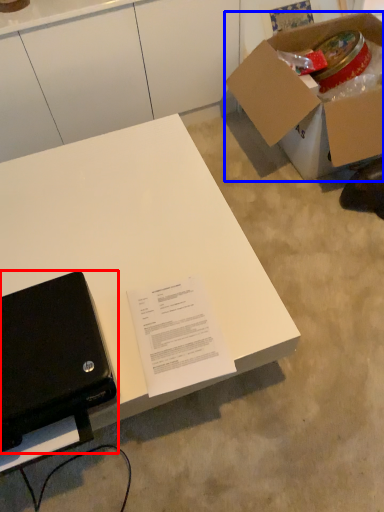
Question: Which point is closer to the camera, laptop (highlighted by a red box) or box (highlighted by a blue box)?

Choices:
 (A) laptop
 (B) box

Answer: (A)